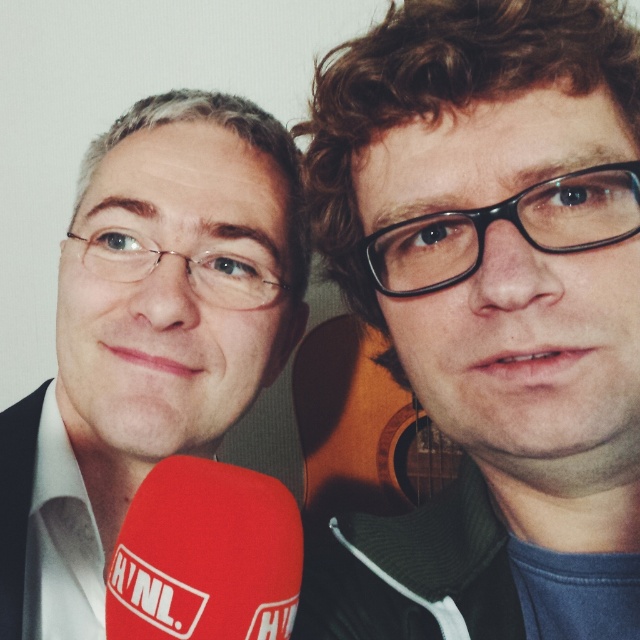
You are a photographer setting up for a portrait. You need to ensure that the matte black suit at left and the red fabric microphone at lower left are both visible in the frame. Which object should you focus on to ensure both are in focus, considering their sizes?

The matte black suit at left has a larger size compared to the red fabric microphone at lower left. To ensure both are in focus, focus on the larger object, the matte black suit at left, as depth of field is typically better when focusing on larger subjects closer to the camera.

You are a photographer trying to capture a clear shot of both the matte black glasses at center and the matte black suit at left. Since the background is blurred, which object should you focus on first to ensure it appears sharp in the photo?

The matte black glasses at center is in front of the matte black suit at left, so you should focus on the matte black glasses at center first to ensure it appears sharp in the photo.